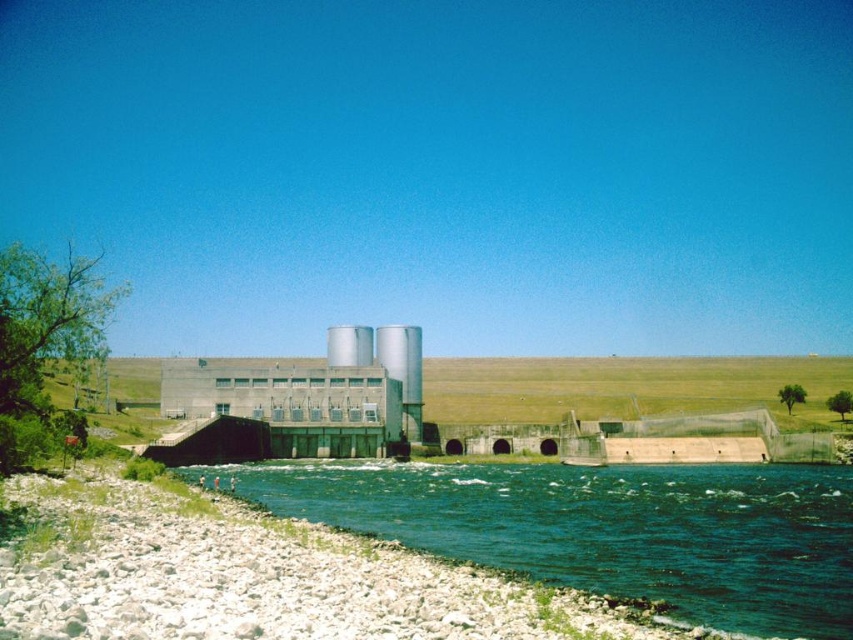
Question: Can you confirm if green smooth water at lower left is positioned to the left of concrete gray power station at center?

Choices:
 (A) yes
 (B) no

Answer: (B)

Question: Which point appears closest to the camera in this image?

Choices:
 (A) (370, 339)
 (B) (370, 387)

Answer: (B)

Question: Estimate the real-world distances between objects in this image. Which object is closer to the silver metallic silo at center?

Choices:
 (A) concrete gray power station at center
 (B) green smooth water at lower left

Answer: (A)

Question: Which of the following is the farthest from the observer?

Choices:
 (A) (186, 387)
 (B) (326, 480)
 (C) (334, 355)

Answer: (C)

Question: Is concrete gray power station at center positioned before silver metallic silo at center?

Choices:
 (A) yes
 (B) no

Answer: (A)

Question: Is concrete gray power station at center thinner than silver metallic silo at center?

Choices:
 (A) yes
 (B) no

Answer: (B)